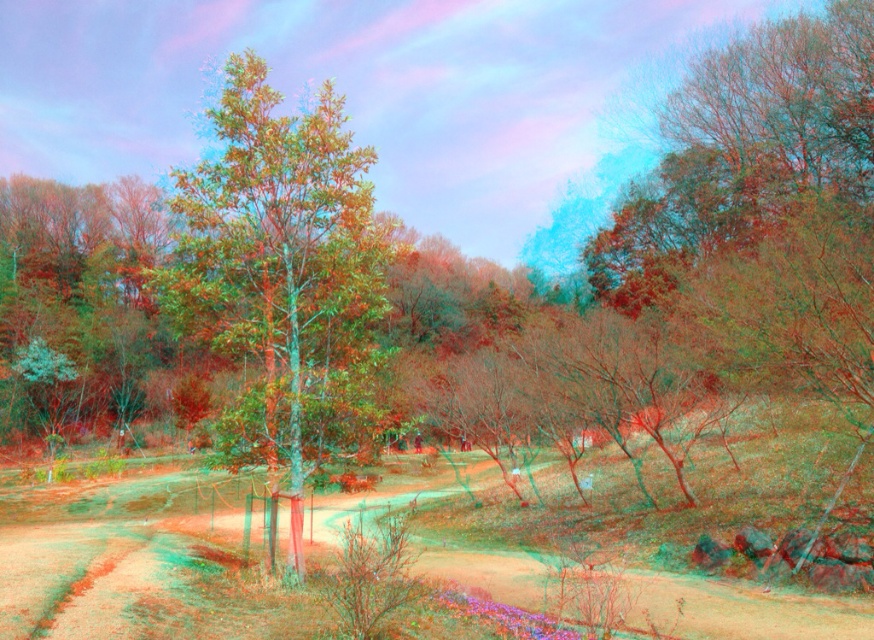
Question: Does brown dirt track at center have a larger size compared to green matte tree at center?

Choices:
 (A) no
 (B) yes

Answer: (A)

Question: In this image, where is brown dirt track at center located relative to green matte tree at center?

Choices:
 (A) right
 (B) left

Answer: (A)

Question: Which object is farther from the camera taking this photo?

Choices:
 (A) green matte tree at center
 (B) brown dirt track at center

Answer: (A)

Question: Does brown dirt track at center come behind green matte tree at center?

Choices:
 (A) yes
 (B) no

Answer: (B)

Question: Which point appears closest to the camera in this image?

Choices:
 (A) (366, 161)
 (B) (676, 628)

Answer: (B)